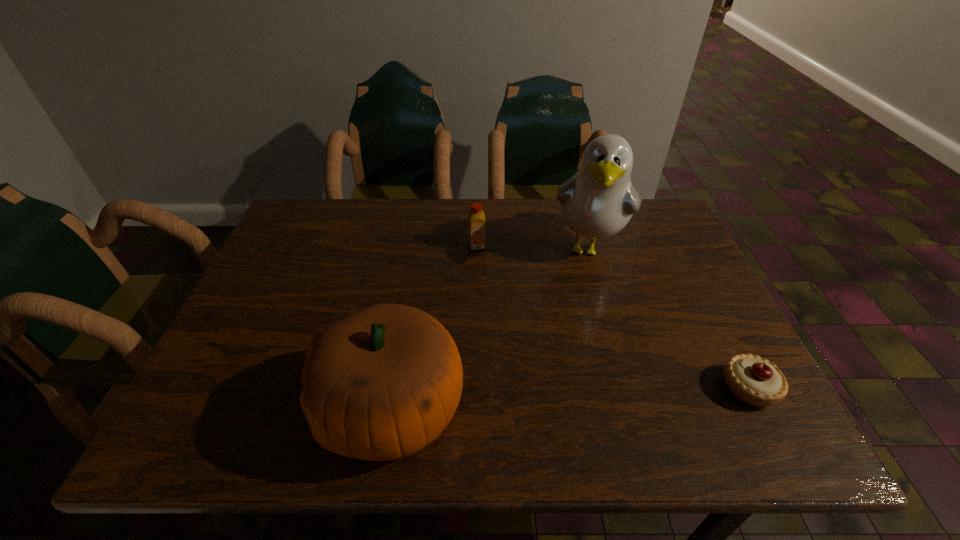
In order to click on pumpkin in this screenshot , I will do `click(380, 384)`.

Identify the location of the shortest object. The width and height of the screenshot is (960, 540). (754, 380).

This screenshot has height=540, width=960. What are the coordinates of `pastry` in the screenshot? It's located at (754, 380).

This screenshot has width=960, height=540. Find the location of `orange juice`. orange juice is located at coordinates (476, 220).

You are a GUI agent. You are given a task and a screenshot of the screen. Output one action in this format:
    pyautogui.click(x=<x>, y=<y>)
    Task: Click on the third object from left to right
    
    Given the screenshot: What is the action you would take?
    pyautogui.click(x=597, y=202)

You are a GUI agent. You are given a task and a screenshot of the screen. Output one action in this format:
    pyautogui.click(x=<x>, y=<y>)
    Task: Click on the tallest object
    The height and width of the screenshot is (540, 960).
    Given the screenshot: What is the action you would take?
    pyautogui.click(x=597, y=202)

Find the location of a particular element. This screenshot has width=960, height=540. blank area located 0.330m on the left of the rightmost object is located at coordinates (x=560, y=388).

What are the coordinates of `vacant space located 0.210m on the front and back of the second shortest object` in the screenshot? It's located at (495, 306).

Locate an element on the screen. This screenshot has height=540, width=960. vacant space situated on the front and back of the second shortest object is located at coordinates (507, 341).

I want to click on vacant space located on the front and back of the second shortest object, so click(502, 324).